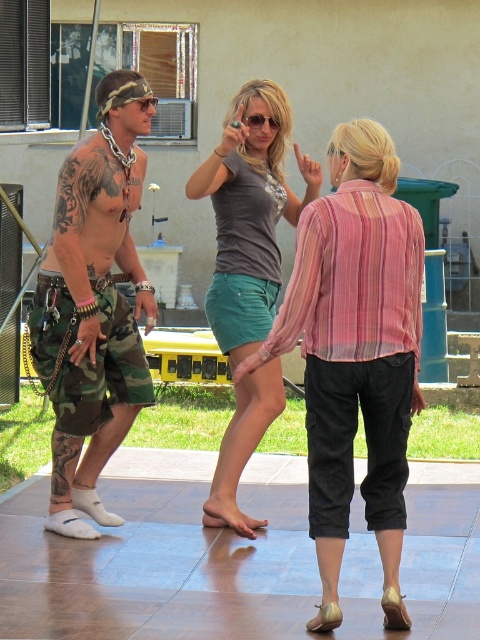
Between camo shorts at left and matte gray shirt at center, which one is positioned lower?

camo shorts at left is below.

Who is higher up, camo shorts at left or matte gray shirt at center?

matte gray shirt at center is above.

Based on the photo, measure the distance between point (x=112, y=93) and camera.

The distance of point (x=112, y=93) from camera is 23.20 feet.

Where is `camo shorts at left`? The image size is (480, 640). camo shorts at left is located at coordinates (95, 304).

Which is behind, point (370, 458) or point (37, 317)?

The point (37, 317) is behind.

Is matte black shorts at center wider than camo shorts at left?

Yes.

The height and width of the screenshot is (640, 480). What are the coordinates of `matte black shorts at center` in the screenshot? It's located at (356, 353).

Is matte black shorts at center below matte gray shirt at center?

Indeed, matte black shorts at center is positioned under matte gray shirt at center.

Is point (347, 492) positioned behind point (279, 168)?

That is False.

I want to click on matte black shorts at center, so click(356, 353).